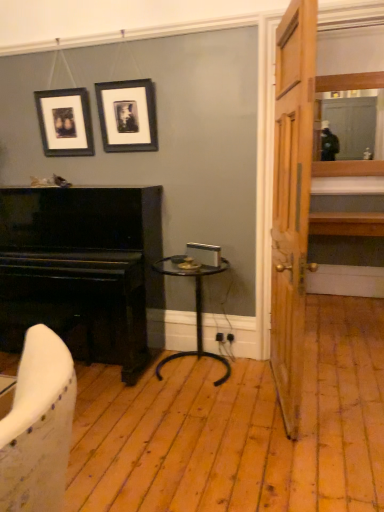
Question: Is black matte picture frame at upper center, which is counted as the 2th picture frame, starting from the left, oriented away from black polished piano at left?

Choices:
 (A) no
 (B) yes

Answer: (A)

Question: Is black matte picture frame at upper center, which ranks as the 1th picture frame in right-to-left order, in front of black polished piano at left?

Choices:
 (A) no
 (B) yes

Answer: (A)

Question: Does black matte picture frame at upper center, which ranks as the 1th picture frame in right-to-left order, have a greater height compared to black polished piano at left?

Choices:
 (A) yes
 (B) no

Answer: (B)

Question: Could black polished piano at left be considered to be inside black matte picture frame at upper center, which ranks as the 1th picture frame in right-to-left order?

Choices:
 (A) yes
 (B) no

Answer: (B)

Question: Does black matte picture frame at upper center, which ranks as the 1th picture frame in right-to-left order, have a lesser width compared to black polished piano at left?

Choices:
 (A) yes
 (B) no

Answer: (A)

Question: Considering the positions of point (112, 287) and point (152, 265), is point (112, 287) closer or farther from the camera than point (152, 265)?

Choices:
 (A) closer
 (B) farther

Answer: (A)

Question: In terms of width, does black polished piano at left look wider or thinner when compared to black metal side table at center?

Choices:
 (A) wide
 (B) thin

Answer: (A)

Question: From the image's perspective, is black polished piano at left positioned above or below black metal side table at center?

Choices:
 (A) above
 (B) below

Answer: (A)

Question: From a real-world perspective, is black polished piano at left physically located above or below black metal side table at center?

Choices:
 (A) below
 (B) above

Answer: (B)

Question: Considering their positions, is black metal side table at center located in front of or behind wooden door at right?

Choices:
 (A) behind
 (B) front

Answer: (A)

Question: Is black metal side table at center taller or shorter than wooden door at right?

Choices:
 (A) short
 (B) tall

Answer: (A)

Question: From a real-world perspective, relative to wooden door at right, is black metal side table at center vertically above or below?

Choices:
 (A) above
 (B) below

Answer: (B)

Question: From the image's perspective, is black metal side table at center located above or below wooden door at right?

Choices:
 (A) above
 (B) below

Answer: (B)

Question: Considering the relative positions of wooden door at right and black matte picture frame at upper center, which is counted as the 2th picture frame, starting from the left, in the image provided, is wooden door at right to the left or to the right of black matte picture frame at upper center, which is counted as the 2th picture frame, starting from the left,?

Choices:
 (A) left
 (B) right

Answer: (B)

Question: Is point (276, 108) positioned closer to the camera than point (109, 98)?

Choices:
 (A) closer
 (B) farther

Answer: (A)